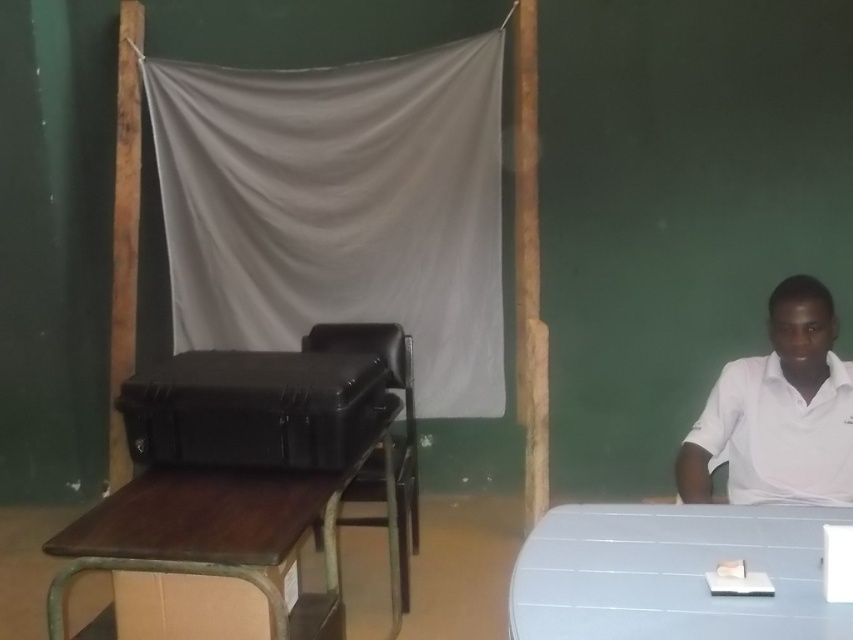
You are a delivery person who needs to place a large package on the table. The package is 25 inches long. There is a black hard case at center and a black leather chair at center. Can you fit the package between them?

The black hard case at center and black leather chair at center are 25.02 inches apart from each other. Since the package is 25 inches long, it can fit between them with a small amount of space remaining.

You are organizing a classroom and need to determine seating arrangements. You see the white matte shirt at right and the black leather chair at center. Which object is shorter?

The white matte shirt at right is shorter than the black leather chair at center.

You are standing in the classroom and want to sit down. There is a white matte shirt at right and a black leather chair at center. Which object is closer to you?

The white matte shirt at right is closer to the viewer than the black leather chair at center.